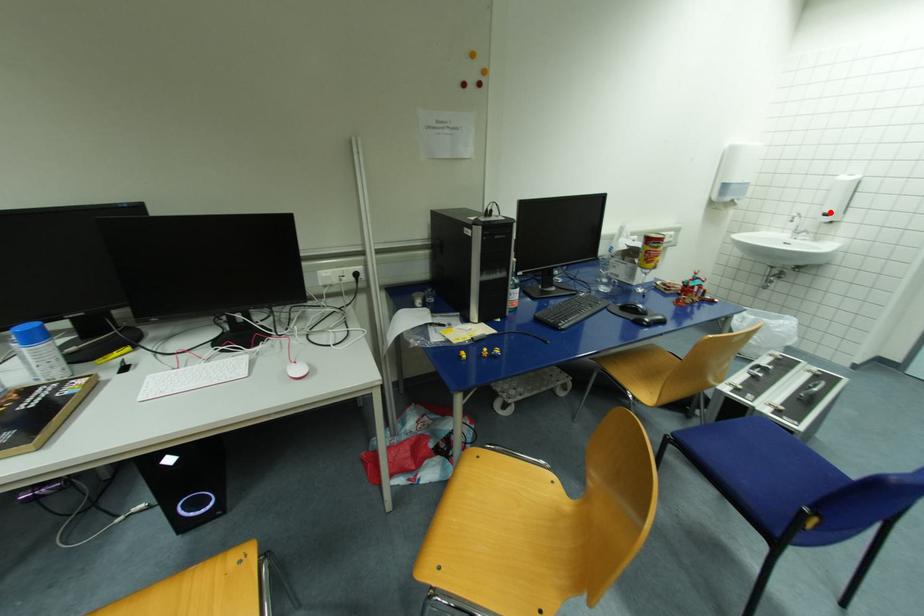
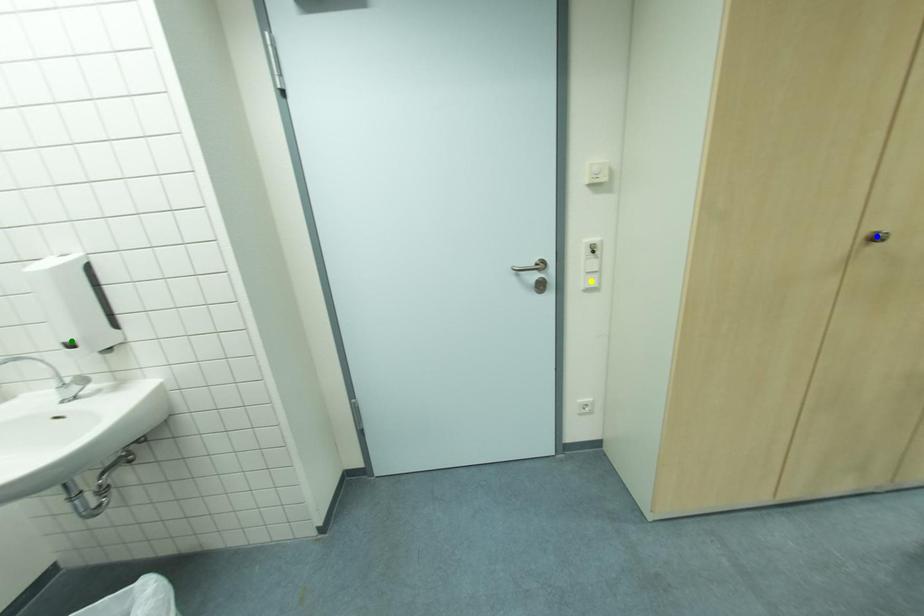
Question: I am providing you with two images of the same scene from different viewpoints. A red point is marked on the first image. You are given multiple points on the second image. In image 2, which mark is for the same physical point as the one in image 1?

Choices:
 (A) blue point
 (B) yellow point
 (C) green point

Answer: (C)